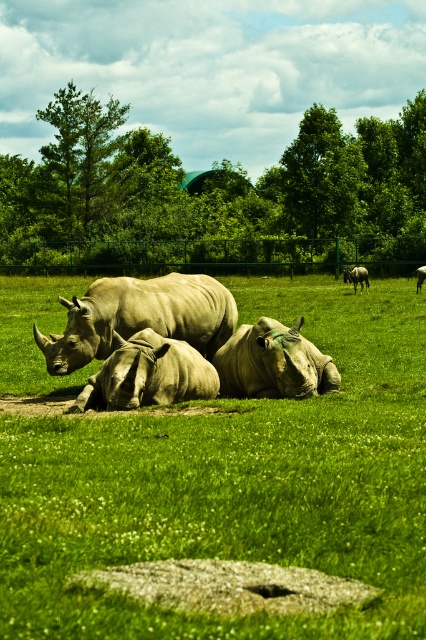
You are standing at the point marked as point (77, 163) in the image. Looking around, you see a green leafy tree at upper left. What object is located exactly at your current position?

The point (77, 163) is where the green leafy tree at upper left is located.

You are a wildlife photographer planning to capture a photo of the three rhinos resting on the lush green grassy field. You want to ensure the green leafy tree at upper center appears in the background of your photo. Based on the distance provided, will the tree be in focus if you focus on the rhinos?

The green leafy tree at upper center is 163.55 feet away from the camera. If you focus on the rhinos, which are much closer, the tree may not be in focus unless your camera has a large depth of field. To ensure both the rhinos and the tree are in focus, you might need to adjust your aperture or use a smaller aperture setting for a greater depth of field.

You are a wildlife photographer aiming to capture a clear photo of both the smooth gray rhino at center and the matte gray rhino at center. However, you notice that one of them is blocking the view of the other. Which rhino is blocking the view of the other?

The smooth gray rhino at center is positioned under the matte gray rhino at center, so the matte gray rhino at center is blocking the view of the smooth gray rhino at center.